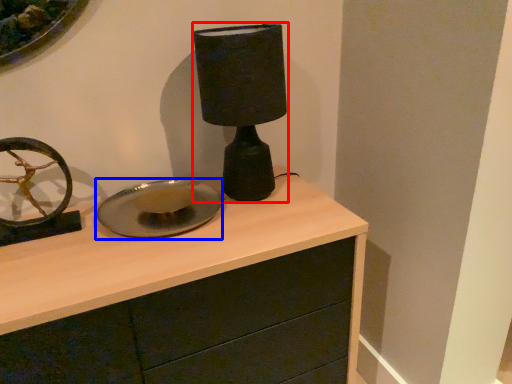
Question: Which point is closer to the camera, table lamp (highlighted by a red box) or plate (highlighted by a blue box)?

Choices:
 (A) table lamp
 (B) plate

Answer: (A)